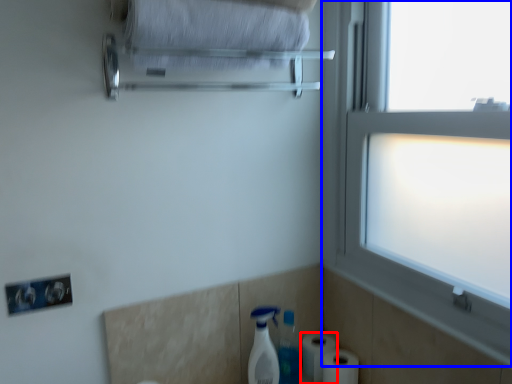
Question: Among these objects, which one is nearest to the camera, toilet paper (highlighted by a red box) or window (highlighted by a blue box)?

Choices:
 (A) toilet paper
 (B) window

Answer: (B)